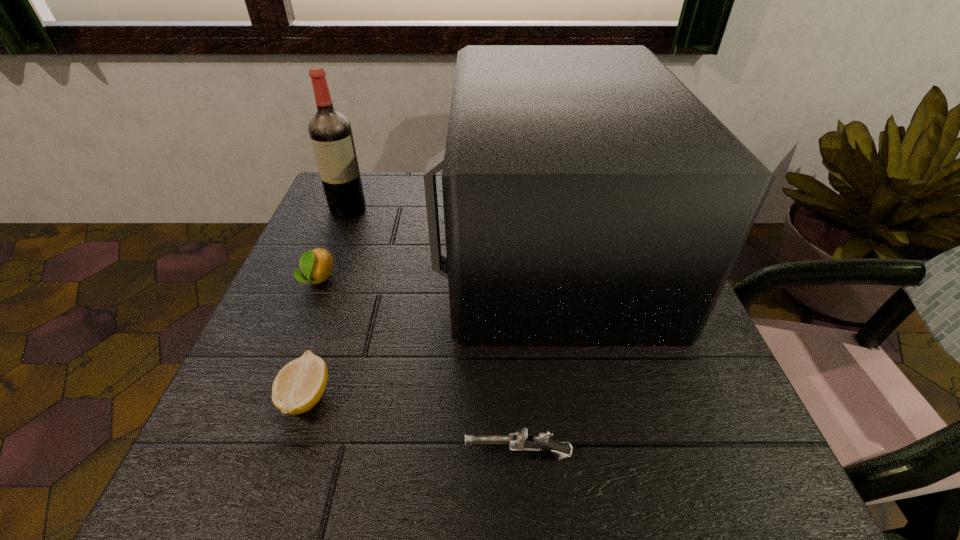
The image size is (960, 540). I want to click on object located at the far left corner, so click(x=330, y=132).

This screenshot has height=540, width=960. I want to click on object situated at the far right corner, so [590, 198].

The image size is (960, 540). Find the location of `vacant region at the far edge`. vacant region at the far edge is located at coordinates (390, 197).

Locate an element on the screen. free space at the near edge of the desktop is located at coordinates (400, 453).

This screenshot has width=960, height=540. Find the location of `vacant space at the right edge`. vacant space at the right edge is located at coordinates (644, 405).

Identify the location of vacant region between the shorter lemon and the microwave oven. (427, 320).

At what (x,y) coordinates should I click in order to perform the action: click on vacant area that lies between the microwave oven and the nearest object. Please return your answer as a coordinate pair (x, y). The height and width of the screenshot is (540, 960). Looking at the image, I should click on (534, 349).

Find the location of a particular element. The height and width of the screenshot is (540, 960). blank region between the gun and the microwave oven is located at coordinates (534, 349).

Where is `free space between the taller lemon and the gun`? free space between the taller lemon and the gun is located at coordinates 419,367.

Find the location of `free space between the nearest object and the taller lemon`. free space between the nearest object and the taller lemon is located at coordinates (419, 367).